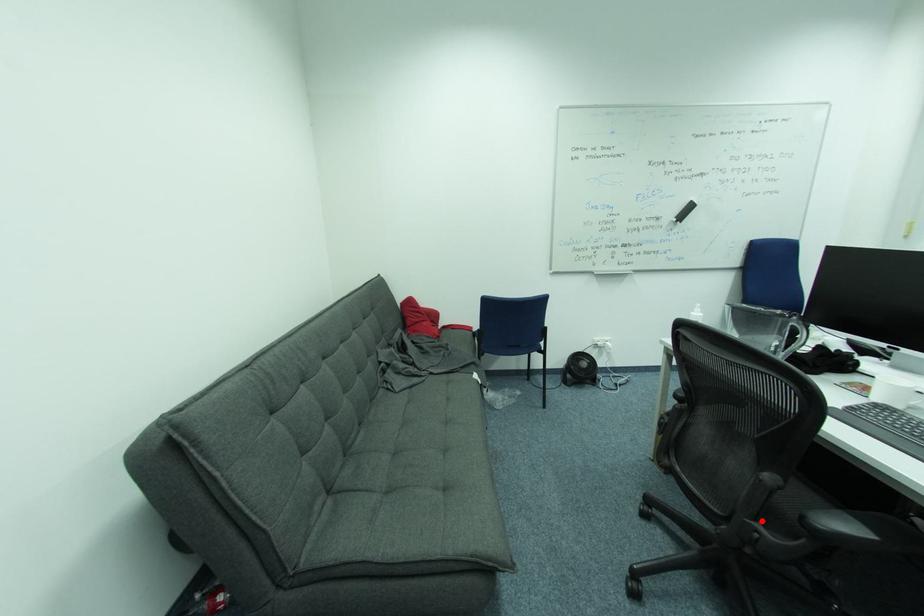
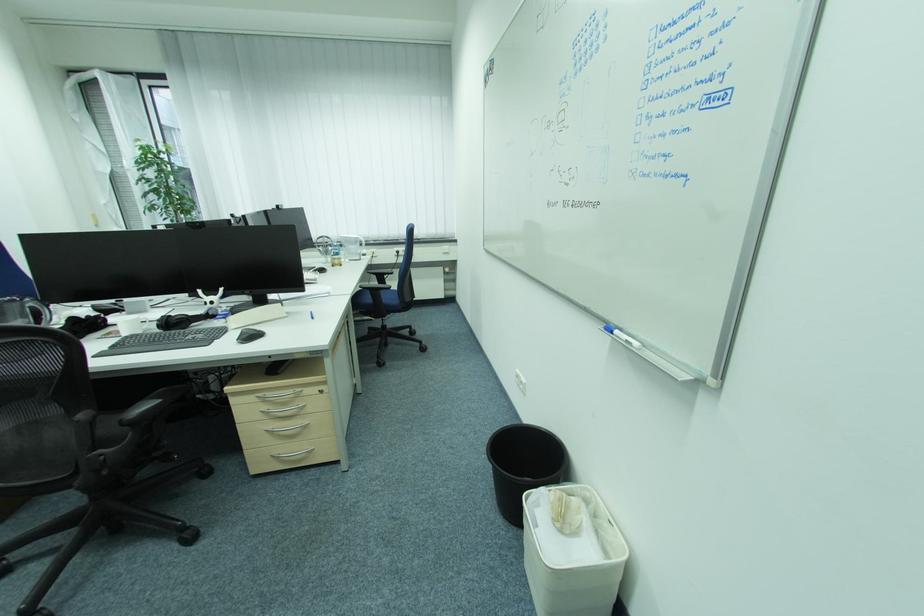
Find the pixel in the second image that matches the highlighted location in the first image.

(102, 452)